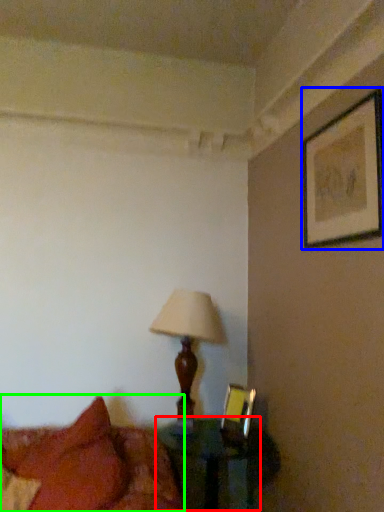
Question: Estimate the real-world distances between objects in this image. Which object is closer to table (highlighted by a red box), picture frame (highlighted by a blue box) or bed (highlighted by a green box)?

Choices:
 (A) picture frame
 (B) bed

Answer: (B)